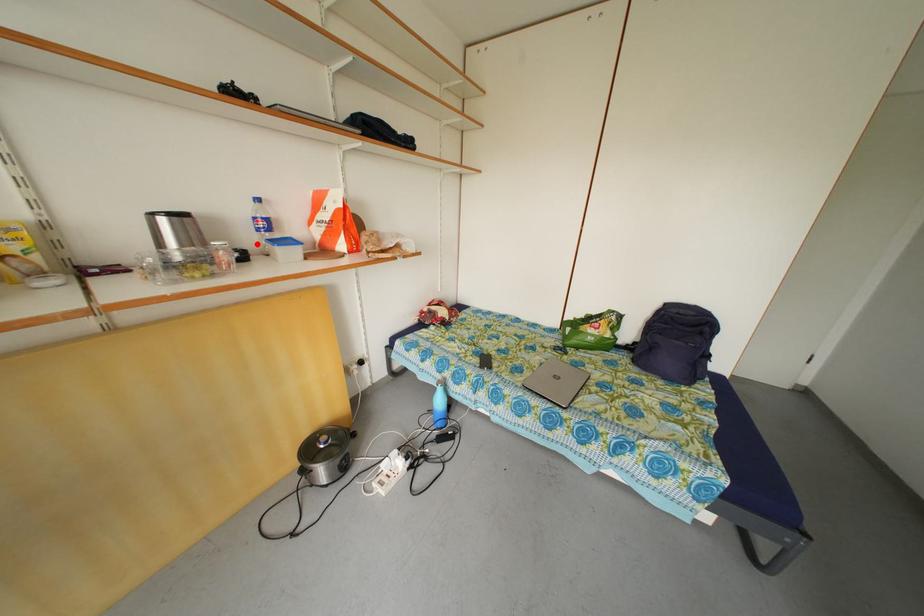
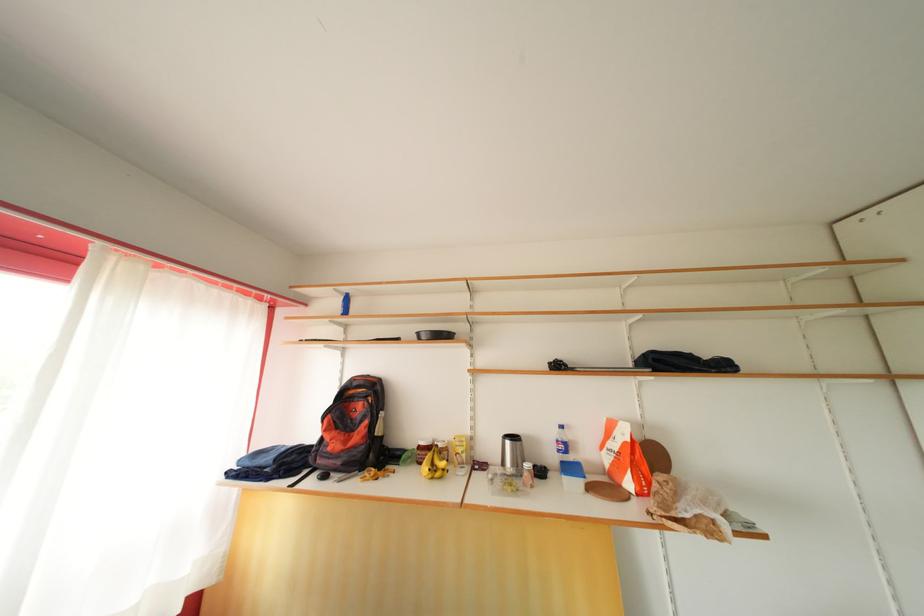
Question: A red point is marked in image1. In image2, is the corresponding 3D point closer to the camera or farther? Reply with the corresponding letter.

Choices:
 (A) The corresponding 3D point is closer.
 (B) The corresponding 3D point is farther.

Answer: (B)